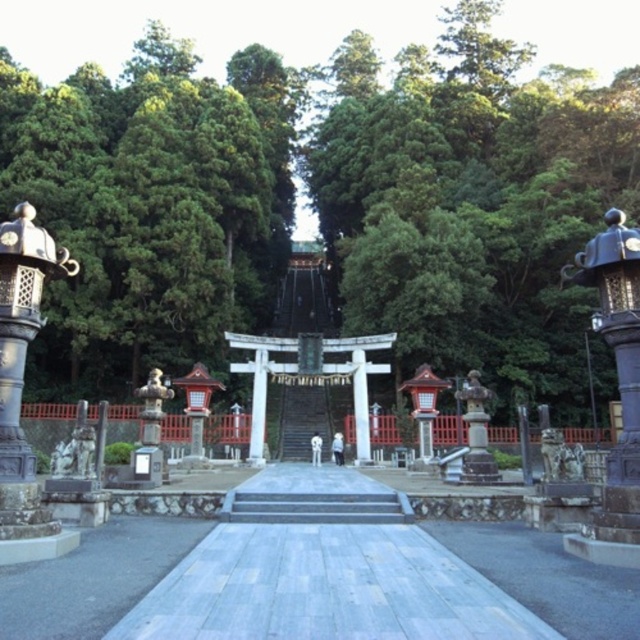
You are standing at the entrance of the shrine and want to walk towards the torii gate. There are two points marked on the ground ahead of you. One is at coordinate point (131, 234) and the other is at point (586, 280). Which point is closer to you as you face the shrine?

Point (131, 234) is closer to you because it is further to the camera than point (586, 280), meaning it is nearer in your line of sight.

You are a visitor at the shrine and want to place a 2 meter wide decoration between the green leafy tree at center and the polished bronze lantern at right. Is there enough space for it?

The distance between the green leafy tree at center and the polished bronze lantern at right is 55.66 meters, so yes, there is enough space to place a 2 meter wide decoration between them.